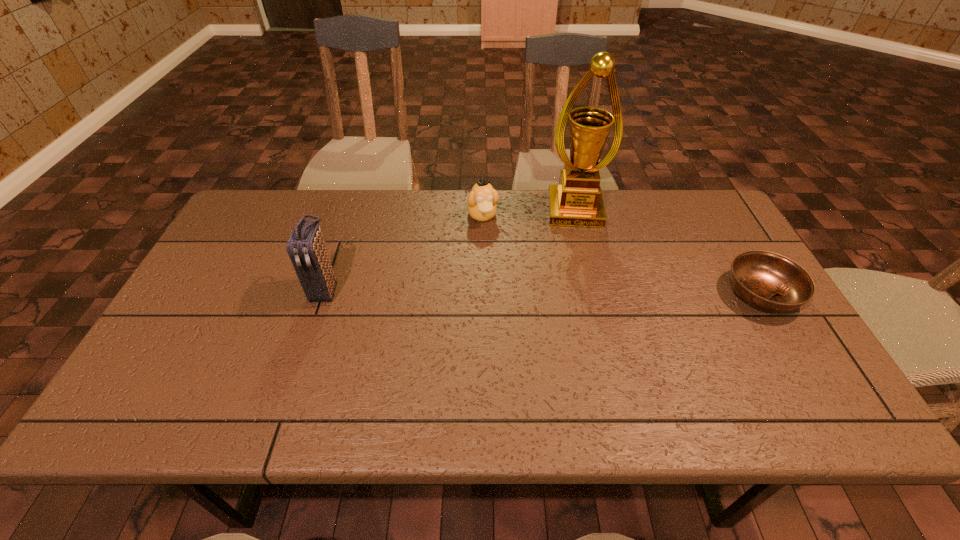
Find the location of a particular element. The image size is (960, 540). vacant space located on the face of the third object from right to left is located at coordinates (508, 303).

In order to click on vacant space located 0.240m on the face of the third object from right to left in this screenshot , I will do `click(503, 286)`.

At what (x,y) coordinates should I click in order to perform the action: click on vacant space located on the face of the third object from right to left. Please return your answer as a coordinate pair (x, y). Looking at the image, I should click on (512, 315).

The width and height of the screenshot is (960, 540). Find the location of `vacant region located on the front-facing side of the tallest object`. vacant region located on the front-facing side of the tallest object is located at coordinates (581, 270).

Locate an element on the screen. blank area located on the front-facing side of the tallest object is located at coordinates (580, 258).

Where is `blank area located 0.130m on the front-facing side of the tallest object`? This screenshot has width=960, height=540. blank area located 0.130m on the front-facing side of the tallest object is located at coordinates (580, 258).

This screenshot has width=960, height=540. Find the location of `duckling that is at the far edge`. duckling that is at the far edge is located at coordinates (482, 200).

Locate an element on the screen. award located at the far edge is located at coordinates (577, 201).

Locate an element on the screen. object present at the right edge is located at coordinates point(768,281).

Identify the location of free space at the far edge of the desktop. The image size is (960, 540). (547, 235).